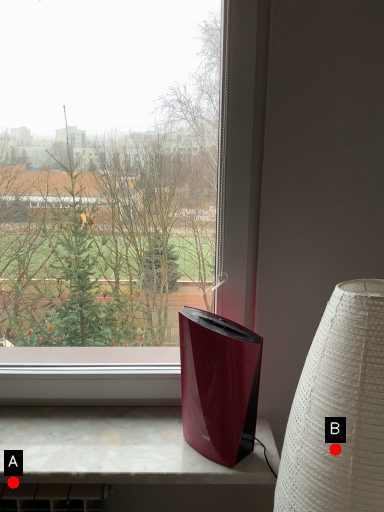
Question: Two points are circled on the image, labeled by A and B beside each circle. Which point is closer to the camera?

Choices:
 (A) A is closer
 (B) B is closer

Answer: (B)